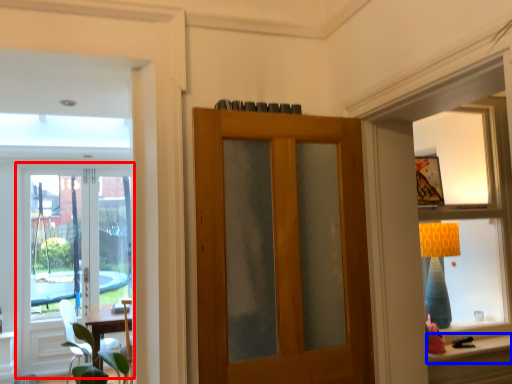
Question: Among these objects, which one is farthest to the camera, door (highlighted by a red box) or window sill (highlighted by a blue box)?

Choices:
 (A) door
 (B) window sill

Answer: (A)